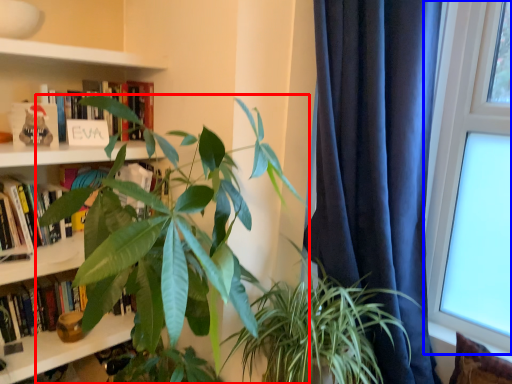
Question: Which object appears farthest to the camera in this image, houseplant (highlighted by a red box) or window (highlighted by a blue box)?

Choices:
 (A) houseplant
 (B) window

Answer: (B)